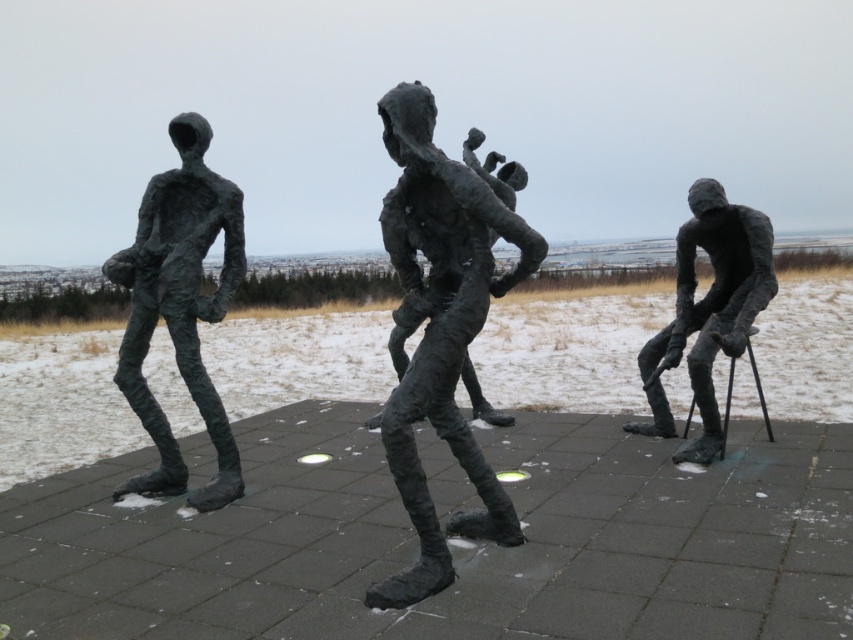
Question: Which point is closer to the camera?

Choices:
 (A) bronze sculpture at center
 (B) green patina bronze figure at left

Answer: (A)

Question: Which point is closer to the camera taking this photo?

Choices:
 (A) tap(463, 460)
 (B) tap(242, 225)
 (C) tap(720, 260)

Answer: (A)

Question: From the image, what is the correct spatial relationship of bronze sculpture at center in relation to green patina bronze figure at left?

Choices:
 (A) below
 (B) above

Answer: (A)

Question: Does green patina bronze figure at left have a smaller size compared to bronze sculpture at right?

Choices:
 (A) yes
 (B) no

Answer: (B)

Question: Which of the following is the farthest from the observer?

Choices:
 (A) bronze sculpture at center
 (B) green patina bronze figure at left

Answer: (B)

Question: Is bronze sculpture at center bigger than bronze sculpture at right?

Choices:
 (A) no
 (B) yes

Answer: (B)